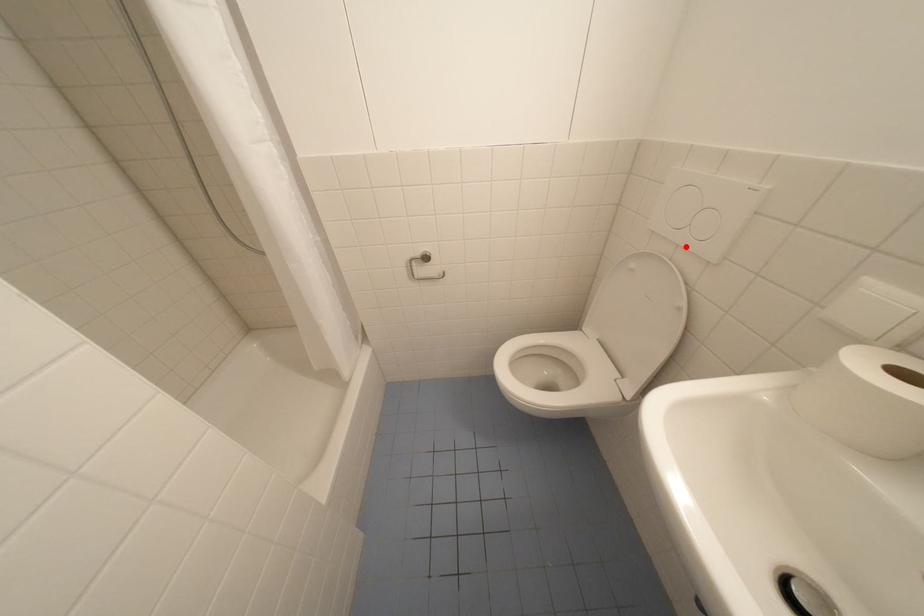
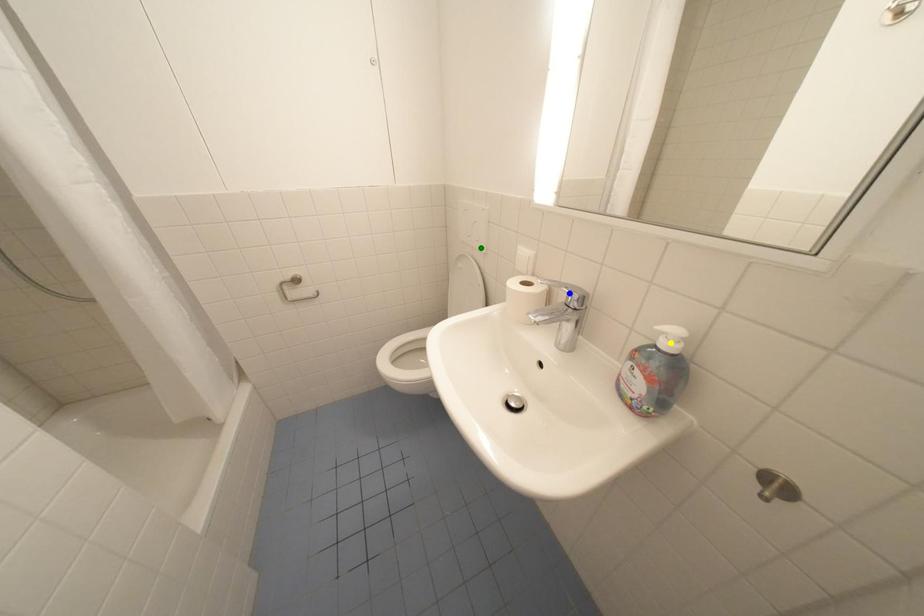
Question: I am providing you with two images of the same scene from different viewpoints. A red point is marked on the first image. You are given multiple points on the second image. Which mark in image 2 goes with the point in image 1?

Choices:
 (A) green point
 (B) yellow point
 (C) blue point

Answer: (A)